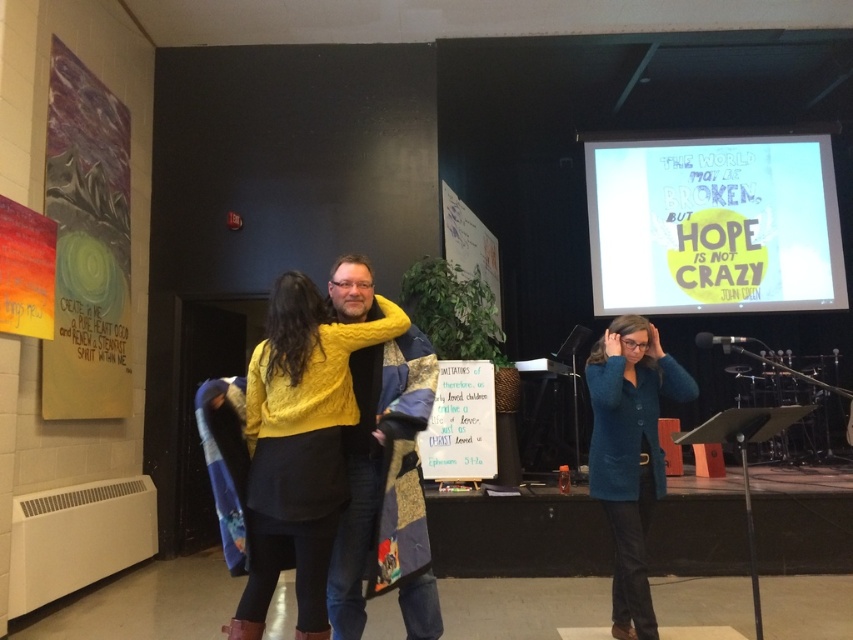
Question: Which of the following is the closest to the observer?

Choices:
 (A) white glossy projection screen at upper right
 (B) knitted yellow scarf at center
 (C) teal matte blazer at center

Answer: (B)

Question: Can you confirm if white glossy projection screen at upper right is smaller than knitted yellow scarf at center?

Choices:
 (A) no
 (B) yes

Answer: (A)

Question: Does white glossy projection screen at upper right come behind teal matte blazer at center?

Choices:
 (A) yes
 (B) no

Answer: (A)

Question: Which of the following is the farthest from the observer?

Choices:
 (A) (403, 368)
 (B) (630, 403)

Answer: (B)

Question: Which object appears farthest from the camera in this image?

Choices:
 (A) knitted yellow sweater at center
 (B) teal matte blazer at center

Answer: (B)

Question: Can you confirm if white glossy projection screen at upper right is thinner than knitted yellow scarf at center?

Choices:
 (A) no
 (B) yes

Answer: (A)